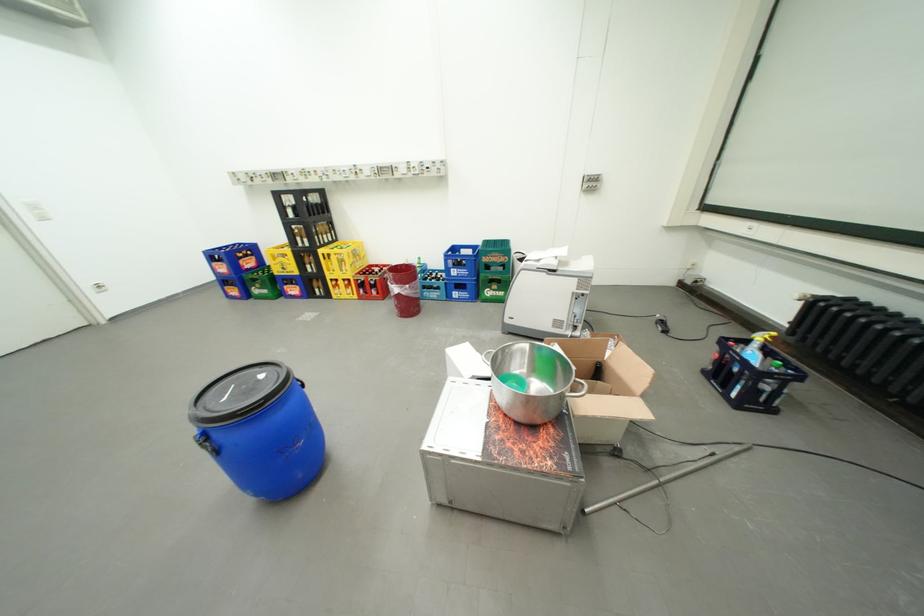
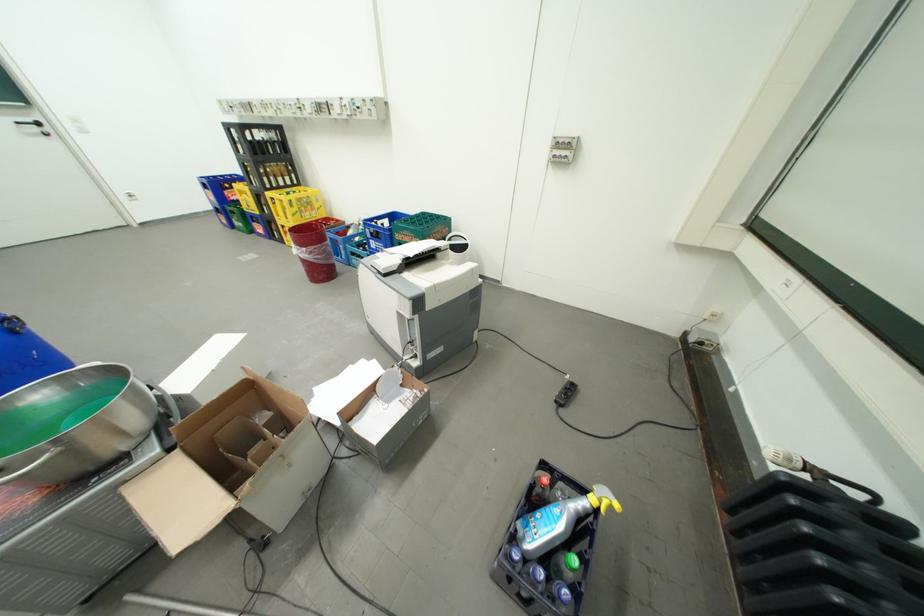
In the second image, find the point that corresponds to point 513,257 in the first image.

(424, 238)